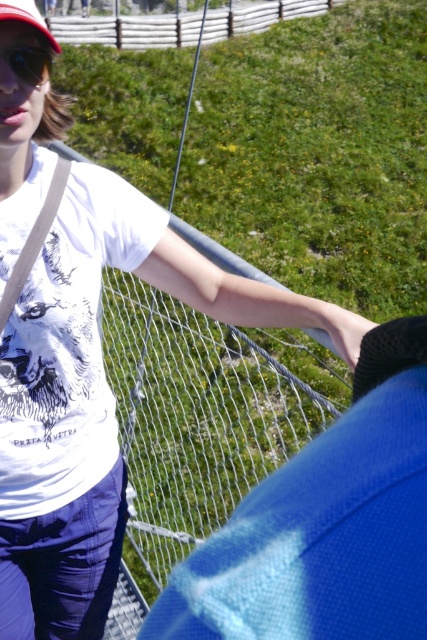
Who is higher up, matte black goggles at upper left or matte red baseball cap at upper left?

matte red baseball cap at upper left is above.

Does matte black goggles at upper left have a greater width compared to matte red baseball cap at upper left?

No, matte black goggles at upper left is not wider than matte red baseball cap at upper left.

Is point (14, 67) more distant than point (26, 13)?

Yes, it is.

Locate an element on the screen. The height and width of the screenshot is (640, 427). matte black goggles at upper left is located at coordinates (28, 64).